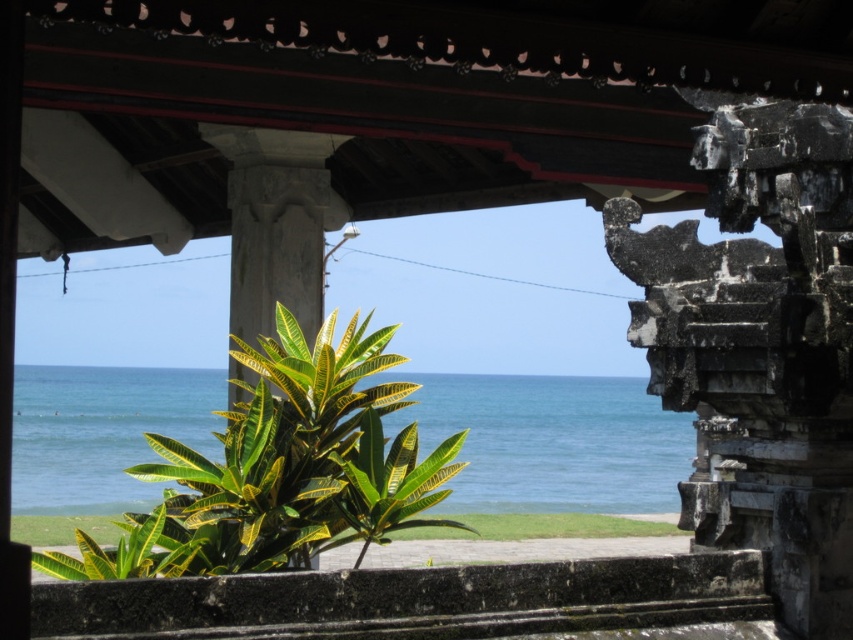
Which of these two, blue water at center or green leafy plant at center, stands taller?

Standing taller between the two is blue water at center.

From the picture: Who is more forward, (601, 448) or (125, 554)?

Point (125, 554) is more forward.

Between point (589, 420) and point (270, 492), which one is positioned behind?

Positioned behind is point (589, 420).

The image size is (853, 640). Find the location of `blue water at center`. blue water at center is located at coordinates (552, 442).